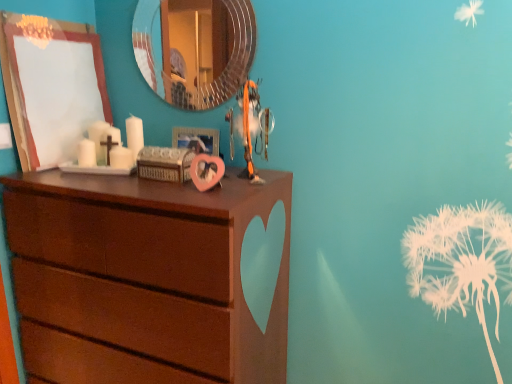
Question: Is orange fabric toy at center wider than metallic circular mirror at upper center?

Choices:
 (A) yes
 (B) no

Answer: (A)

Question: Is orange fabric toy at center further to camera compared to metallic circular mirror at upper center?

Choices:
 (A) yes
 (B) no

Answer: (B)

Question: From the image's perspective, would you say orange fabric toy at center is positioned over metallic circular mirror at upper center?

Choices:
 (A) no
 (B) yes

Answer: (A)

Question: From a real-world perspective, does orange fabric toy at center sit lower than metallic circular mirror at upper center?

Choices:
 (A) yes
 (B) no

Answer: (A)

Question: Considering the relative positions of orange fabric toy at center and metallic circular mirror at upper center in the image provided, is orange fabric toy at center in front of metallic circular mirror at upper center?

Choices:
 (A) no
 (B) yes

Answer: (B)

Question: From a real-world perspective, relative to metallic circular mirror at upper center, is brown wood chest of drawers at left vertically above or below?

Choices:
 (A) above
 (B) below

Answer: (B)

Question: In the image, is brown wood chest of drawers at left positioned in front of or behind metallic circular mirror at upper center?

Choices:
 (A) behind
 (B) front

Answer: (B)

Question: Looking at the image, does brown wood chest of drawers at left seem bigger or smaller compared to metallic circular mirror at upper center?

Choices:
 (A) small
 (B) big

Answer: (B)

Question: From the image's perspective, relative to metallic circular mirror at upper center, is brown wood chest of drawers at left above or below?

Choices:
 (A) below
 (B) above

Answer: (A)

Question: From the image's perspective, is metallic circular mirror at upper center above or below pink matte heart-shaped frame at center, marked as the first picture frame in a right-to-left arrangement?

Choices:
 (A) below
 (B) above

Answer: (B)

Question: Based on their sizes in the image, would you say metallic circular mirror at upper center is bigger or smaller than pink matte heart-shaped frame at center, marked as the first picture frame in a right-to-left arrangement?

Choices:
 (A) big
 (B) small

Answer: (A)

Question: In terms of width, does metallic circular mirror at upper center look wider or thinner when compared to pink matte heart-shaped frame at center, arranged as the 2th picture frame when viewed from the left?

Choices:
 (A) wide
 (B) thin

Answer: (B)

Question: Is metallic circular mirror at upper center taller or shorter than pink matte heart-shaped frame at center, marked as the first picture frame in a right-to-left arrangement?

Choices:
 (A) short
 (B) tall

Answer: (B)

Question: From the image's perspective, is orange fabric toy at center above or below metallic circular mirror at upper center?

Choices:
 (A) below
 (B) above

Answer: (A)

Question: Is orange fabric toy at center to the left or to the right of metallic circular mirror at upper center in the image?

Choices:
 (A) right
 (B) left

Answer: (A)